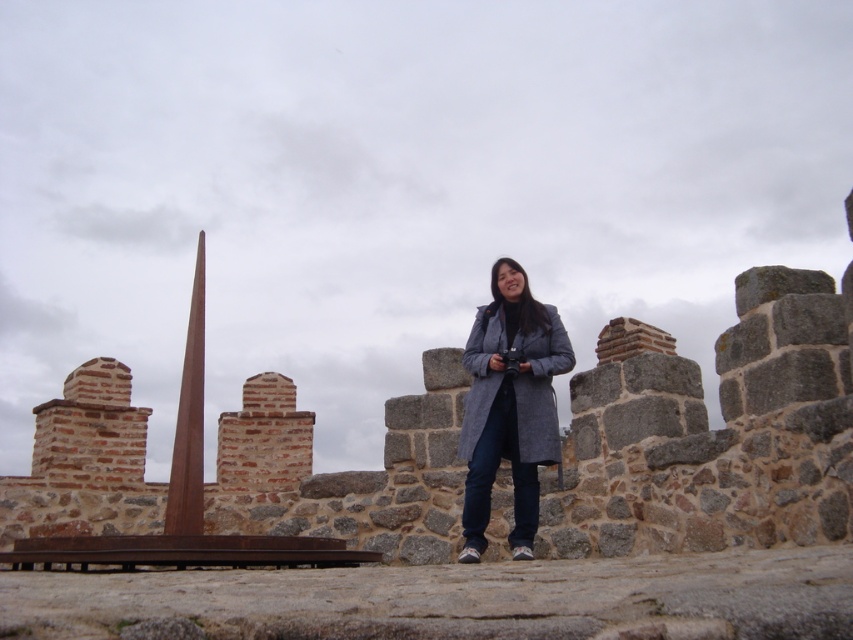
Between brown stone ruins at center and gray wool coat at center, which one is positioned lower?

Positioned lower is gray wool coat at center.

Does brown stone ruins at center lie behind gray wool coat at center?

No, it is in front of gray wool coat at center.

Which is behind, point (805, 380) or point (471, 419)?

The point (471, 419) is behind.

Locate an element on the screen. This screenshot has height=640, width=853. brown stone ruins at center is located at coordinates (712, 433).